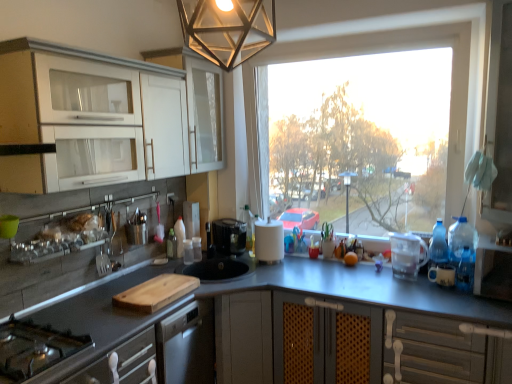
Find the location of a particular element. free point to the left of blue plastic bottle at right, which ranks as the 3th bottle in back-to-front order is located at coordinates (403, 288).